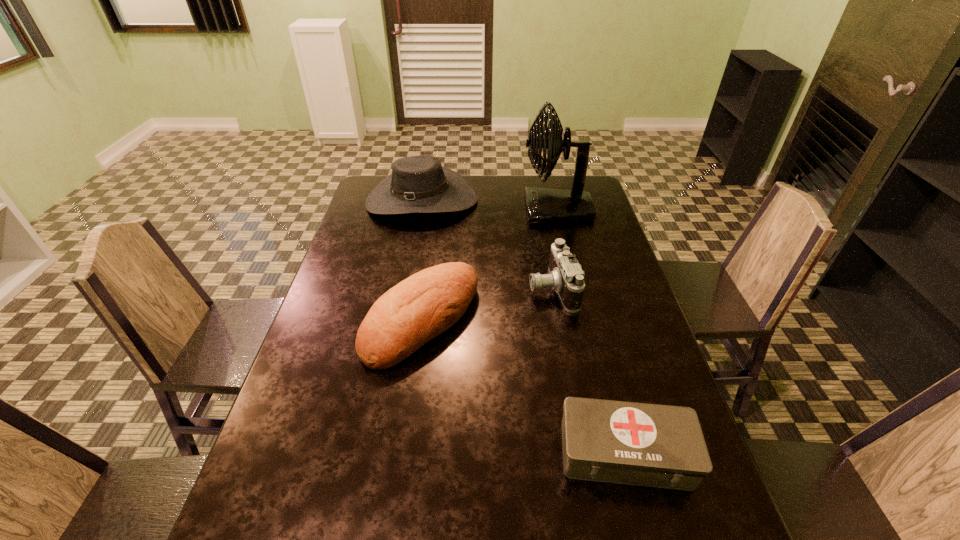
Identify the location of free space between the fan and the second tallest object. The height and width of the screenshot is (540, 960). 489,205.

Find the location of a particular element. The height and width of the screenshot is (540, 960). empty space between the camera and the second tallest object is located at coordinates (487, 244).

Where is `unoccupied area between the first-aid kit and the tallest object`? The width and height of the screenshot is (960, 540). unoccupied area between the first-aid kit and the tallest object is located at coordinates (590, 332).

Image resolution: width=960 pixels, height=540 pixels. What are the coordinates of `free spot between the bread and the camera` in the screenshot? It's located at (487, 303).

This screenshot has height=540, width=960. I want to click on free space between the nearest object and the camera, so click(588, 370).

Where is `empty location between the tallest object and the bread`? empty location between the tallest object and the bread is located at coordinates (489, 265).

Image resolution: width=960 pixels, height=540 pixels. I want to click on object that is the fourth closest one to the first-aid kit, so click(418, 184).

Select which object is the third closest to the camera. Please provide its 2D coordinates. Your answer should be formatted as a tuple, i.e. [(x, y)], where the tuple contains the x and y coordinates of a point satisfying the conditions above.

[(418, 184)]

I want to click on vacant point that satisfies the following two spatial constraints: 1. on the front-facing side of the cowboy hat; 2. on the left side of the nearest object, so click(x=374, y=453).

Where is `free region that satisfies the following two spatial constraints: 1. in front of the fan to blow air; 2. on the front side of the bread`? free region that satisfies the following two spatial constraints: 1. in front of the fan to blow air; 2. on the front side of the bread is located at coordinates (583, 320).